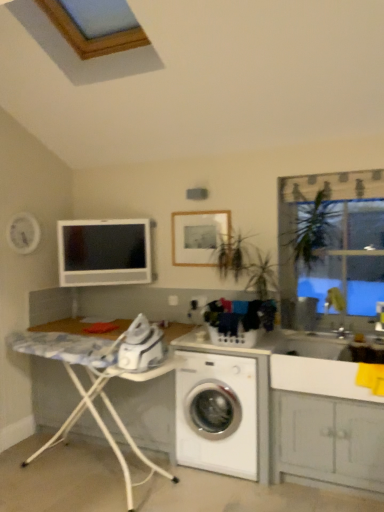
Question: Is white painted wood cabinet at lower right positioned in front of matte white computer monitor at upper left?

Choices:
 (A) yes
 (B) no

Answer: (A)

Question: Is white painted wood cabinet at lower right behind matte white computer monitor at upper left?

Choices:
 (A) yes
 (B) no

Answer: (B)

Question: Could you tell me if white painted wood cabinet at lower right is turned towards matte white computer monitor at upper left?

Choices:
 (A) yes
 (B) no

Answer: (B)

Question: Considering the relative positions of white painted wood cabinet at lower right and matte white computer monitor at upper left in the image provided, is white painted wood cabinet at lower right to the left of matte white computer monitor at upper left from the viewer's perspective?

Choices:
 (A) yes
 (B) no

Answer: (B)

Question: Does white painted wood cabinet at lower right have a greater width compared to matte white computer monitor at upper left?

Choices:
 (A) yes
 (B) no

Answer: (A)

Question: Looking at their shapes, would you say matte white computer monitor at upper left is wider or thinner than white glossy sink at center, acting as the first sink starting from the top?

Choices:
 (A) wide
 (B) thin

Answer: (B)

Question: From a real-world perspective, is matte white computer monitor at upper left above or below white glossy sink at center, acting as the first sink starting from the top?

Choices:
 (A) above
 (B) below

Answer: (A)

Question: From the image's perspective, is matte white computer monitor at upper left positioned above or below white glossy sink at center, the second sink from the bottom?

Choices:
 (A) above
 (B) below

Answer: (A)

Question: Relative to white glossy sink at center, acting as the first sink starting from the top, is matte white computer monitor at upper left in front or behind?

Choices:
 (A) front
 (B) behind

Answer: (B)

Question: Is white glossy sink at lower right, positioned as the 2th sink in top-to-bottom order, in front of or behind white marble ironing board at lower left in the image?

Choices:
 (A) behind
 (B) front

Answer: (A)

Question: Is white glossy sink at lower right, positioned as the 2th sink in top-to-bottom order, situated inside white marble ironing board at lower left or outside?

Choices:
 (A) outside
 (B) inside

Answer: (A)

Question: In terms of height, does white glossy sink at lower right, acting as the 1th sink starting from the bottom, look taller or shorter compared to white marble ironing board at lower left?

Choices:
 (A) short
 (B) tall

Answer: (A)

Question: Is point click(x=364, y=389) closer or farther from the camera than point click(x=102, y=392)?

Choices:
 (A) farther
 (B) closer

Answer: (B)

Question: Is white marble ironing board at lower left bigger or smaller than matte white computer monitor at upper left?

Choices:
 (A) small
 (B) big

Answer: (B)

Question: Is white marble ironing board at lower left wider or thinner than matte white computer monitor at upper left?

Choices:
 (A) thin
 (B) wide

Answer: (B)